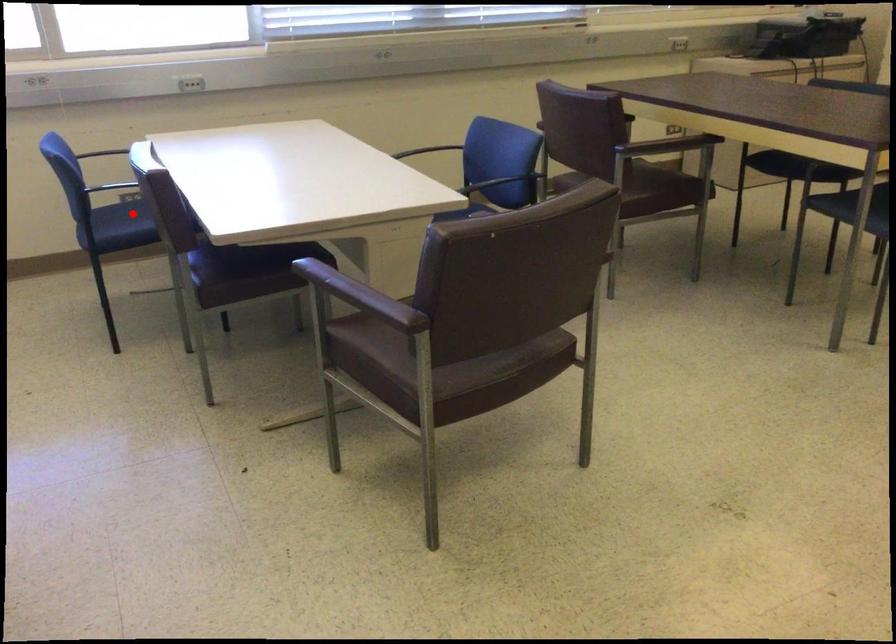
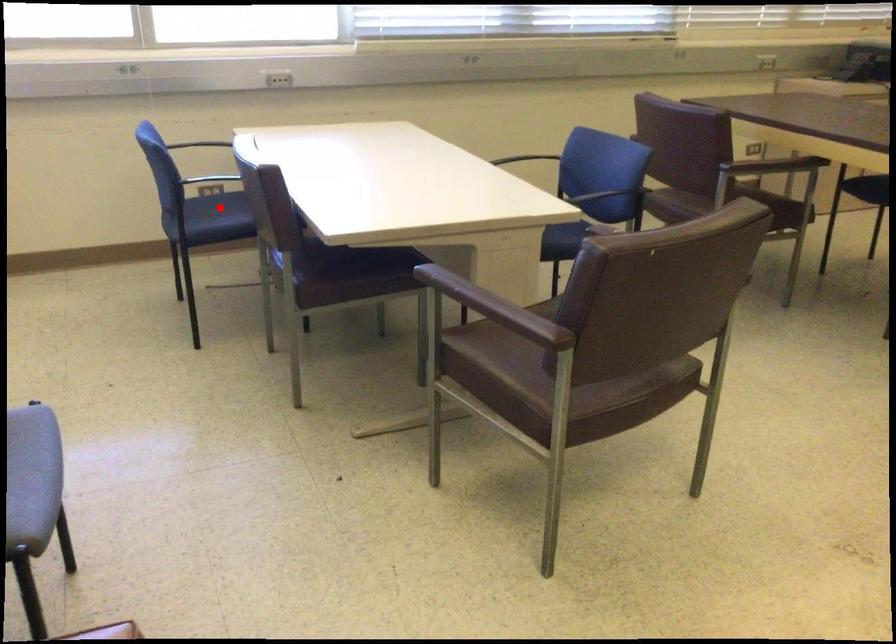
I am providing you with two images of the same scene from different viewpoints. A red point is marked on the first image and another point is marked on the second image. Is the red point in image1 aligned with the point shown in image2?

Yes